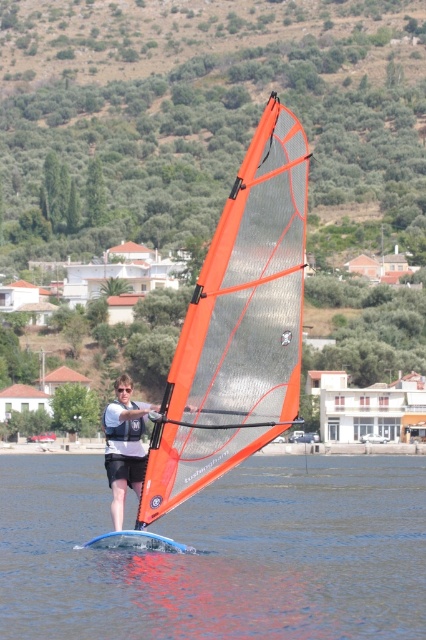
You are a photographer trying to capture the windsurfer from above. Based on the scene, which object is positioned lower in the image between the transparent blue windsurf board at center and the orange mesh sail at center?

The transparent blue windsurf board at center is positioned below the orange mesh sail at center, so it is lower in the image.

You are a photographer trying to capture the windsurfer. You notice two windsurf boards in the image. Which one is closer to you, the transparent blue windsurf board at center or the matte white windsurfing board at center?

The transparent blue windsurf board at center is closer to you because it is positioned in front of the matte white windsurfing board at center.